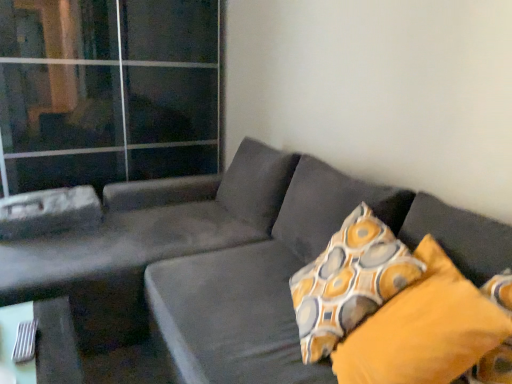
Question: From a real-world perspective, is patterned fabric pillow at right, which is counted as the 1th pillow, starting from the back, above or below velvet dark gray couch at center?

Choices:
 (A) above
 (B) below

Answer: (A)

Question: From the image's perspective, is patterned fabric pillow at right, placed as the 2th pillow when sorted from front to back, positioned above or below velvet dark gray couch at center?

Choices:
 (A) below
 (B) above

Answer: (B)

Question: Based on their relative distances, which object is farther from the patterned fabric pillow at right, placed as the 2th pillow when sorted from front to back?

Choices:
 (A) yellow fabric pillow at right, marked as the 2th pillow in a back-to-front arrangement
 (B) velvet dark gray couch at center
 (C) transparent glass door at upper left

Answer: (C)

Question: Which is farther from the patterned fabric pillow at right, which is counted as the 1th pillow, starting from the back?

Choices:
 (A) transparent glass door at upper left
 (B) yellow fabric pillow at right, which is the 1th pillow from front to back
 (C) velvet dark gray couch at center

Answer: (A)